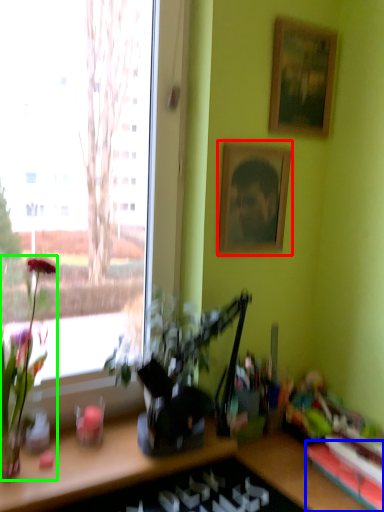
Question: Based on their relative distances, which object is nearer to picture frame (highlighted by a red box)? Choose from shelf (highlighted by a blue box) and houseplant (highlighted by a green box).

Choices:
 (A) shelf
 (B) houseplant

Answer: (B)